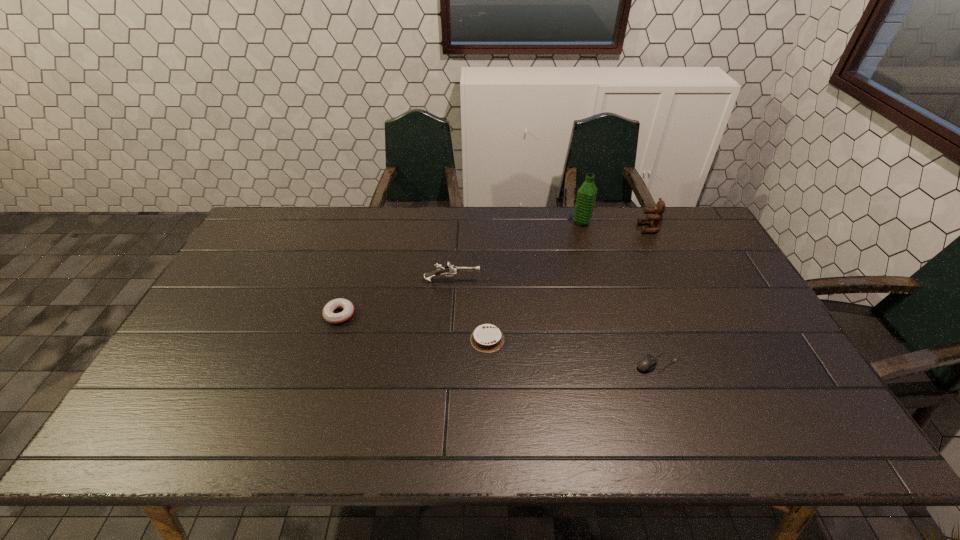
The image size is (960, 540). Identify the location of vacant space at the near edge of the desktop. (681, 429).

Where is `free region at the left edge of the desktop`? The height and width of the screenshot is (540, 960). free region at the left edge of the desktop is located at coordinates (220, 323).

This screenshot has height=540, width=960. In the image, there is a desktop. Identify the location of blank space at the right edge. (730, 298).

At what (x,y) coordinates should I click in order to perform the action: click on vacant space at the near left corner. Please return your answer as a coordinate pair (x, y). Looking at the image, I should click on (201, 422).

Find the location of a particular element. The height and width of the screenshot is (540, 960). free spot at the far right corner of the desktop is located at coordinates (686, 220).

Locate an element on the screen. This screenshot has width=960, height=540. vacant area at the near right corner of the desktop is located at coordinates (789, 426).

Identify the location of free space that is in between the mouse and the teddy bear. This screenshot has height=540, width=960. (653, 295).

Locate an element on the screen. free spot between the fourth nearest object and the chocolate cake is located at coordinates (469, 310).

Identify the location of free space between the doughnut and the chocolate cake. This screenshot has width=960, height=540. (414, 327).

Find the location of a particular element. The image size is (960, 540). free space between the mouse and the chocolate cake is located at coordinates (572, 351).